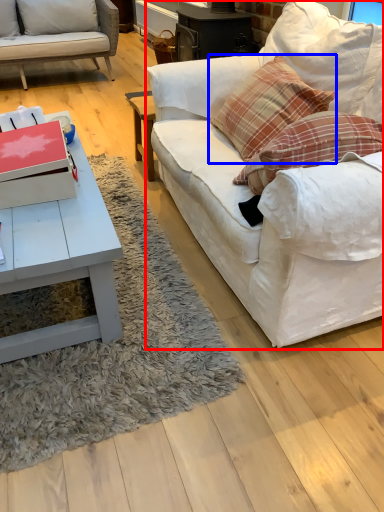
Question: Which object is closer to the camera taking this photo, studio couch (highlighted by a red box) or pillow (highlighted by a blue box)?

Choices:
 (A) studio couch
 (B) pillow

Answer: (A)